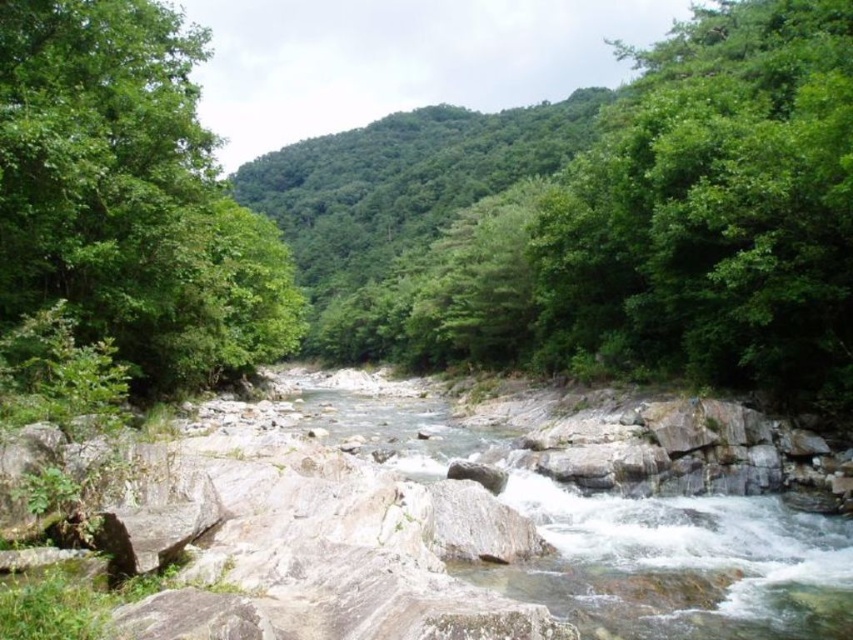
Is point (73, 259) behind point (467, 449)?

No.

Who is positioned more to the left, green leafy tree at left or clear water at center?

green leafy tree at left is more to the left.

Does point (245, 259) come behind point (693, 512)?

Yes.

Where is `green leafy tree at left`? The image size is (853, 640). green leafy tree at left is located at coordinates (131, 196).

Which is behind, point (844, 36) or point (167, 44)?

Positioned behind is point (167, 44).

Who is positioned more to the left, green leafy tree at upper right or green leafy tree at left?

From the viewer's perspective, green leafy tree at left appears more on the left side.

I want to click on green leafy tree at upper right, so click(x=714, y=211).

Identify the location of green leafy tree at upper right. The height and width of the screenshot is (640, 853). (714, 211).

Does green leafy tree at upper right have a greater width compared to clear water at center?

Incorrect, green leafy tree at upper right's width does not surpass clear water at center's.

Does green leafy tree at upper right have a lesser width compared to clear water at center?

Indeed, green leafy tree at upper right has a lesser width compared to clear water at center.

Where is `green leafy tree at upper right`? green leafy tree at upper right is located at coordinates (714, 211).